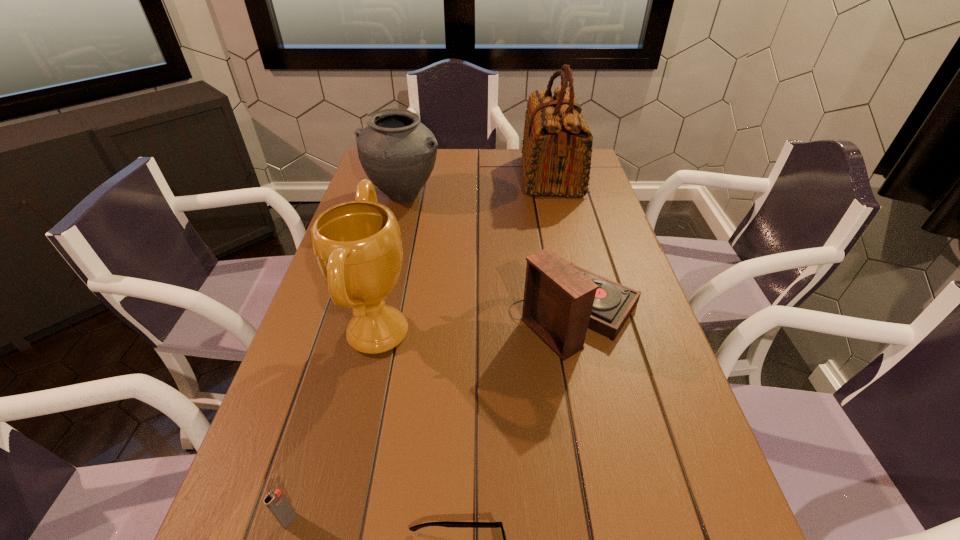
Identify the location of object at the far left corner. The width and height of the screenshot is (960, 540). (397, 152).

The width and height of the screenshot is (960, 540). I want to click on object at the far right corner, so click(x=557, y=147).

In the image, there is a desktop. Where is `vacant space at the far edge`? Image resolution: width=960 pixels, height=540 pixels. vacant space at the far edge is located at coordinates pos(444,176).

You are a GUI agent. You are given a task and a screenshot of the screen. Output one action in this format:
    pyautogui.click(x=<x>, y=<y>)
    Task: Click on the vacant space at the right edge of the desktop
    The image size is (960, 540).
    Given the screenshot: What is the action you would take?
    pyautogui.click(x=653, y=474)

What are the coordinates of `vacant area that lies between the third shortest object and the shopping bag` in the screenshot? It's located at (564, 245).

Find the location of a particular element. The image size is (960, 540). empty space that is in between the fifth tallest object and the third tallest object is located at coordinates (347, 358).

Identify the location of vacant area that lies between the fourth tallest object and the shopping bag. The height and width of the screenshot is (540, 960). (564, 245).

The height and width of the screenshot is (540, 960). Identify the location of the closest object to the fifth farthest object. (446, 523).

Locate an element on the screen. object that stands as the fifth closest to the nearest object is located at coordinates (557, 147).

You are a GUI agent. You are given a task and a screenshot of the screen. Output one action in this format:
    pyautogui.click(x=<x>, y=<y>)
    Task: Click on the free space in the image that satisfies the following two spatial constraints: 1. on the open handle side of the shopping bag; 2. on the front side of the urn
    
    Given the screenshot: What is the action you would take?
    pyautogui.click(x=557, y=195)